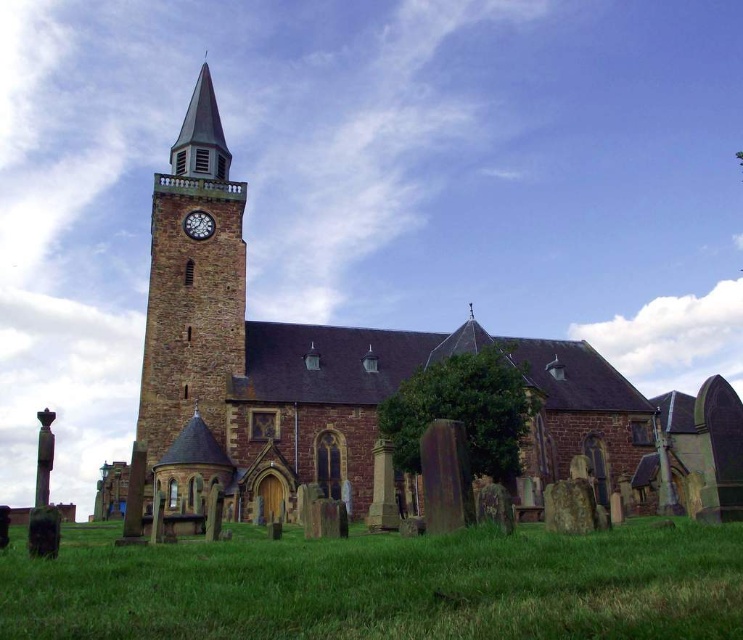
Is brown stone church at center above green grass at lower center?

Correct, brown stone church at center is located above green grass at lower center.

Which is behind, point (327, 378) or point (403, 637)?

Positioned behind is point (327, 378).

The image size is (743, 640). Identify the location of brown stone church at center. (363, 378).

Who is more forward, (x=152, y=301) or (x=212, y=232)?

Point (x=152, y=301) is more forward.

Can you confirm if brown stone church at center is smaller than white clock face at upper left?

Actually, brown stone church at center might be larger than white clock face at upper left.

Image resolution: width=743 pixels, height=640 pixels. I want to click on brown stone church at center, so click(363, 378).

Describe the element at coordinates (386, 588) in the screenshot. I see `green grass at lower center` at that location.

Is green grass at lower center below white clock face at upper left?

Correct, green grass at lower center is located below white clock face at upper left.

Locate an element on the screen. The height and width of the screenshot is (640, 743). green grass at lower center is located at coordinates (386, 588).